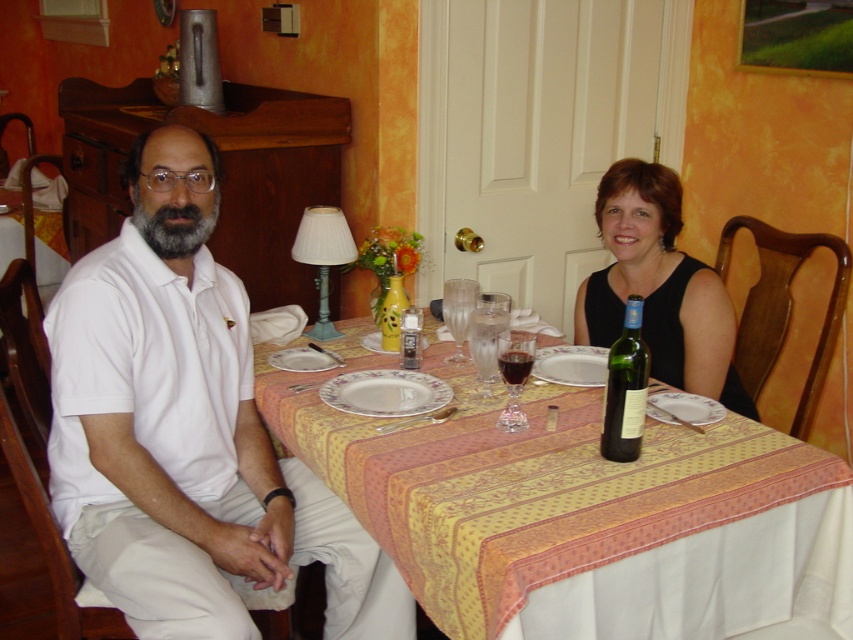
Can you confirm if transparent glass wine glass at table center is smaller than dark red glass at table center?

Incorrect, transparent glass wine glass at table center is not smaller in size than dark red glass at table center.

Does transparent glass wine glass at table center appear under dark red glass at table center?

No, transparent glass wine glass at table center is not below dark red glass at table center.

Is point (461, 285) closer to camera compared to point (519, 380)?

No, it is not.

The width and height of the screenshot is (853, 640). What are the coordinates of `transparent glass wine glass at table center` in the screenshot? It's located at (457, 314).

Does yellow fabric tablecloth at center come behind transparent glass wine glass at table center?

No, it is not.

Can you confirm if yellow fabric tablecloth at center is positioned below transparent glass wine glass at table center?

Yes, yellow fabric tablecloth at center is below transparent glass wine glass at table center.

Who is more distant from viewer, (669, 497) or (447, 326)?

Point (447, 326)

This screenshot has height=640, width=853. Find the location of `yellow fabric tablecloth at center`. yellow fabric tablecloth at center is located at coordinates (531, 488).

Who is more distant from viewer, (x=473, y=358) or (x=405, y=323)?

Point (x=405, y=323)

Is transparent glass at table center thinner than translucent glass vase at table center?

In fact, transparent glass at table center might be wider than translucent glass vase at table center.

Who is more forward, (489,392) or (405,333)?

Positioned in front is point (489,392).

Locate an element on the screen. transparent glass at table center is located at coordinates (485, 348).